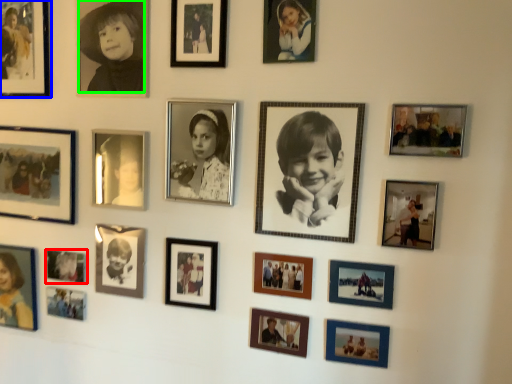
Question: Which object is positioned closest to picture frame (highlighted by a red box)? Select from picture frame (highlighted by a blue box) and person (highlighted by a green box).

Choices:
 (A) picture frame
 (B) person

Answer: (A)